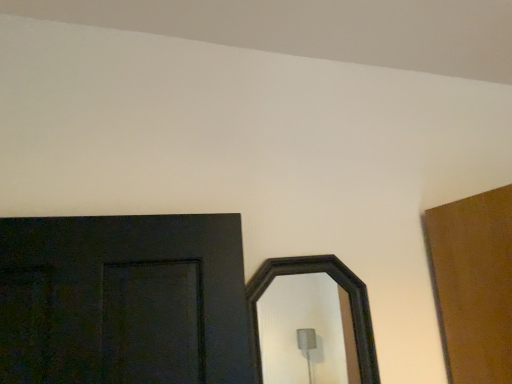
This screenshot has width=512, height=384. Describe the element at coordinates (306, 331) in the screenshot. I see `black wooden mirror at center` at that location.

At what (x,y) coordinates should I click in order to perform the action: click on black wooden mirror at center. Please return your answer as a coordinate pair (x, y). The width and height of the screenshot is (512, 384). Looking at the image, I should click on (306, 331).

Locate an element on the screen. The width and height of the screenshot is (512, 384). black wooden mirror at center is located at coordinates (306, 331).